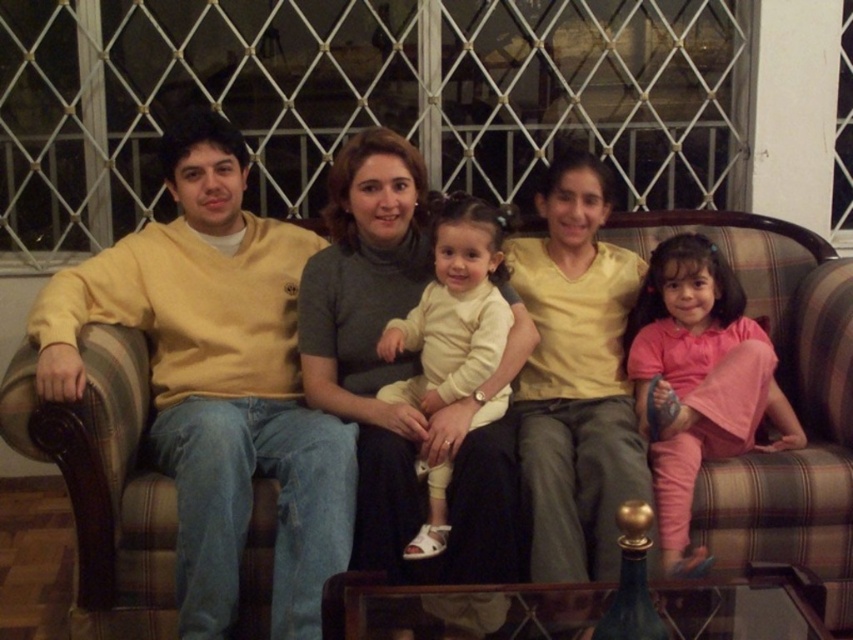
Question: Considering the real-world distances, which object is farthest from the yellow cotton sweater at left?

Choices:
 (A) pink cotton dress at right
 (B) plaid fabric couch at center
 (C) white soft fabric baby at center
 (D) matte gray sweater at center

Answer: (B)

Question: Based on their relative distances, which object is farther from the matte gray sweater at center?

Choices:
 (A) plaid fabric couch at center
 (B) pink cotton dress at right
 (C) yellow cotton sweater at left

Answer: (A)

Question: Can you confirm if yellow cotton sweater at left is positioned below pink cotton dress at right?

Choices:
 (A) no
 (B) yes

Answer: (A)

Question: Which point appears closest to the camera in this image?

Choices:
 (A) (544, 406)
 (B) (775, 442)
 (C) (418, 545)

Answer: (C)

Question: Is matte gray sweater at center bigger than white soft fabric baby at center?

Choices:
 (A) yes
 (B) no

Answer: (A)

Question: Can you confirm if matte gray sweater at center is bigger than white soft fabric baby at center?

Choices:
 (A) no
 (B) yes

Answer: (B)